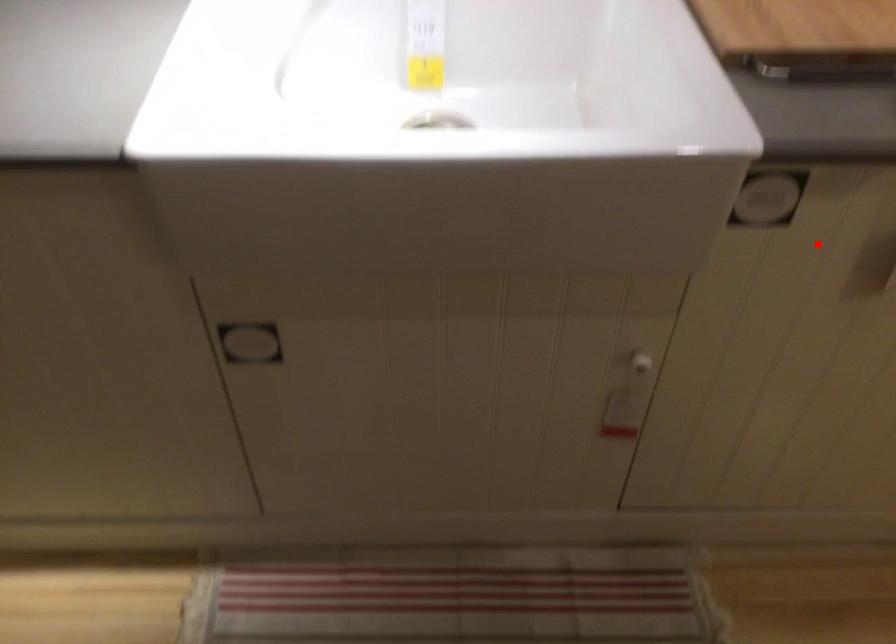
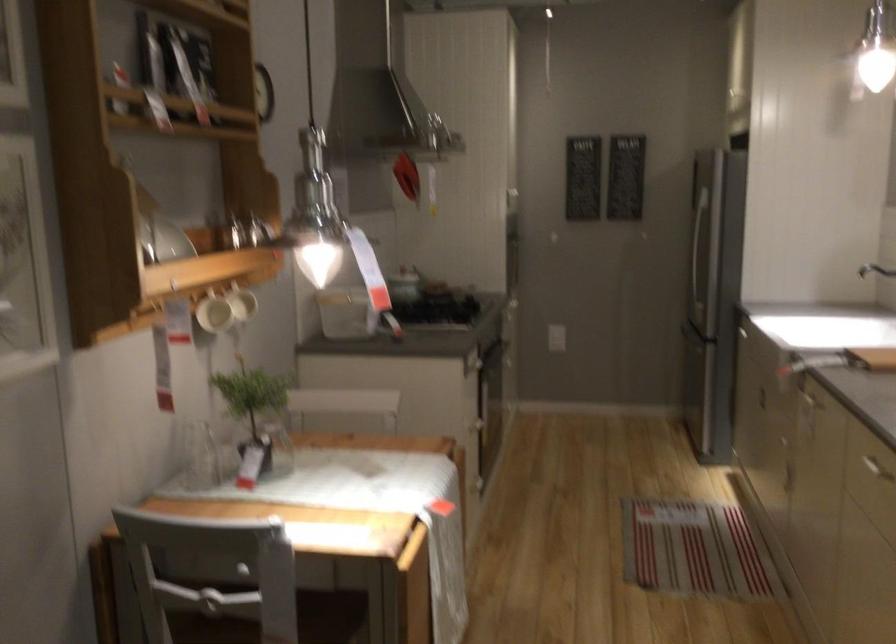
Question: I am providing you with two images of the same scene from different viewpoints. Given a red point in image1, look at the same physical point in image2. Is it:

Choices:
 (A) Closer to the viewpoint
 (B) Farther from the viewpoint

Answer: (B)